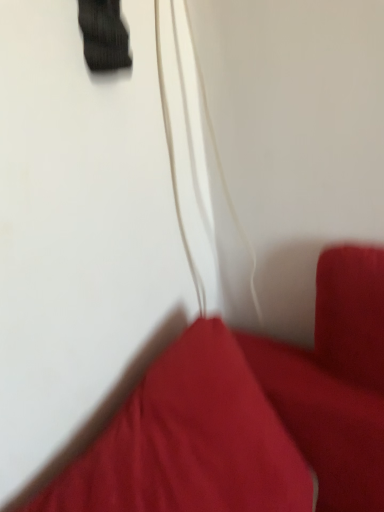
Question: From a real-world perspective, is matte red pillow at lower right above or below white matte string at center?

Choices:
 (A) above
 (B) below

Answer: (B)

Question: Would you say matte red pillow at lower right is inside or outside white matte string at center?

Choices:
 (A) outside
 (B) inside

Answer: (A)

Question: Considering the positions of matte red pillow at lower right and white matte string at center in the image, is matte red pillow at lower right wider or thinner than white matte string at center?

Choices:
 (A) thin
 (B) wide

Answer: (B)

Question: From the image's perspective, is white matte string at center located above or below matte red pillow at lower right?

Choices:
 (A) below
 (B) above

Answer: (B)

Question: Considering their positions, is white matte string at center located in front of or behind matte red pillow at lower right?

Choices:
 (A) front
 (B) behind

Answer: (B)

Question: In terms of height, does white matte string at center look taller or shorter compared to matte red pillow at lower right?

Choices:
 (A) tall
 (B) short

Answer: (A)

Question: Based on their positions, is white matte string at center located to the left or right of matte red pillow at lower right?

Choices:
 (A) right
 (B) left

Answer: (A)